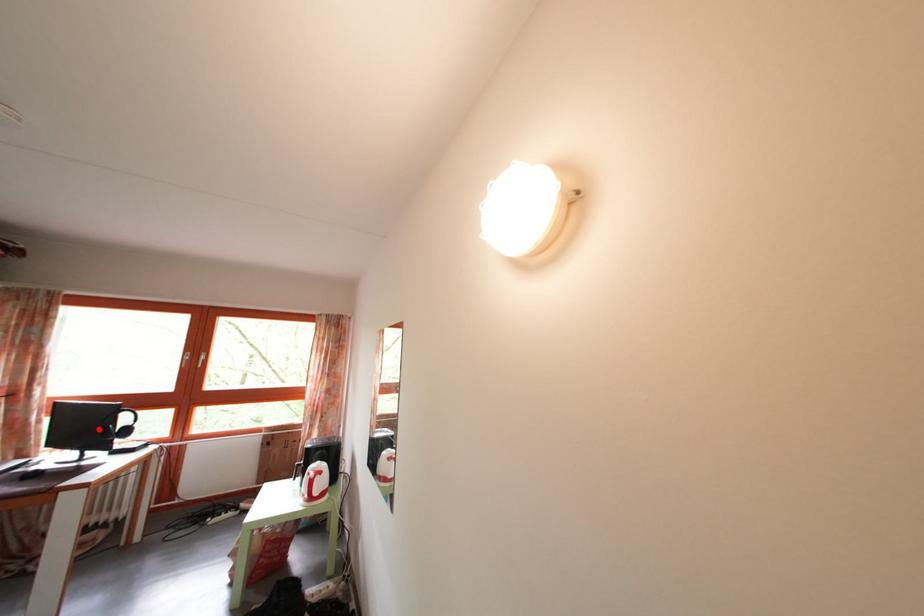
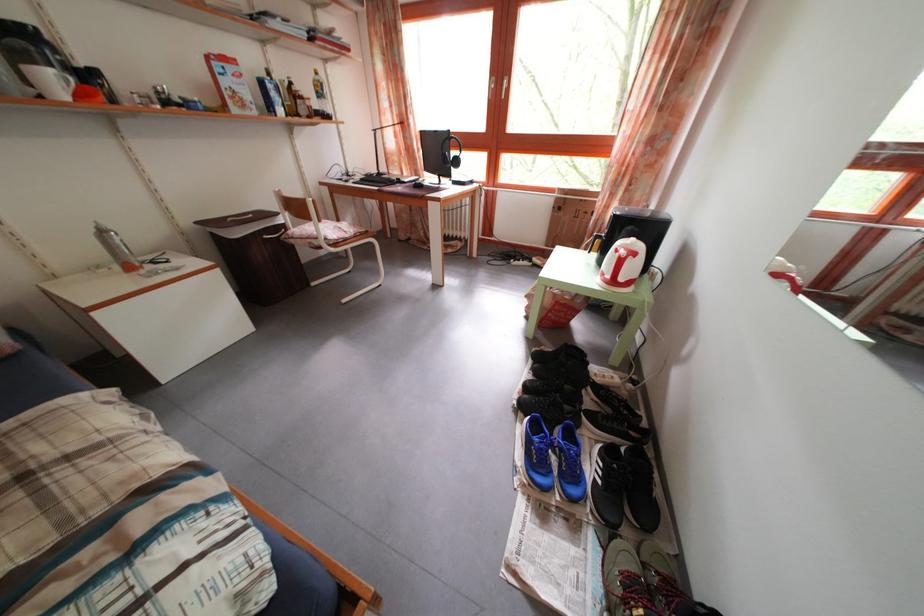
In the second image, find the point that corresponds to the highlighted location in the first image.

(446, 160)